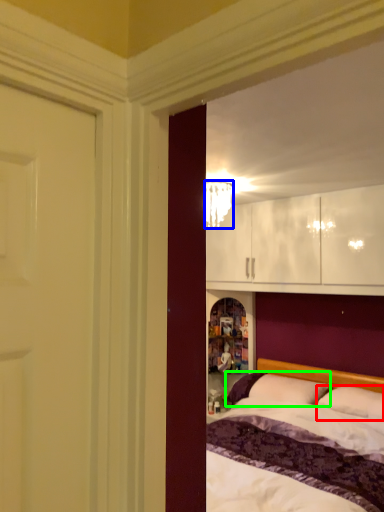
Question: Based on their relative distances, which object is farther from pillow (highlighted by a red box)? Choose from lamp (highlighted by a blue box) and pillow (highlighted by a green box).

Choices:
 (A) lamp
 (B) pillow

Answer: (A)